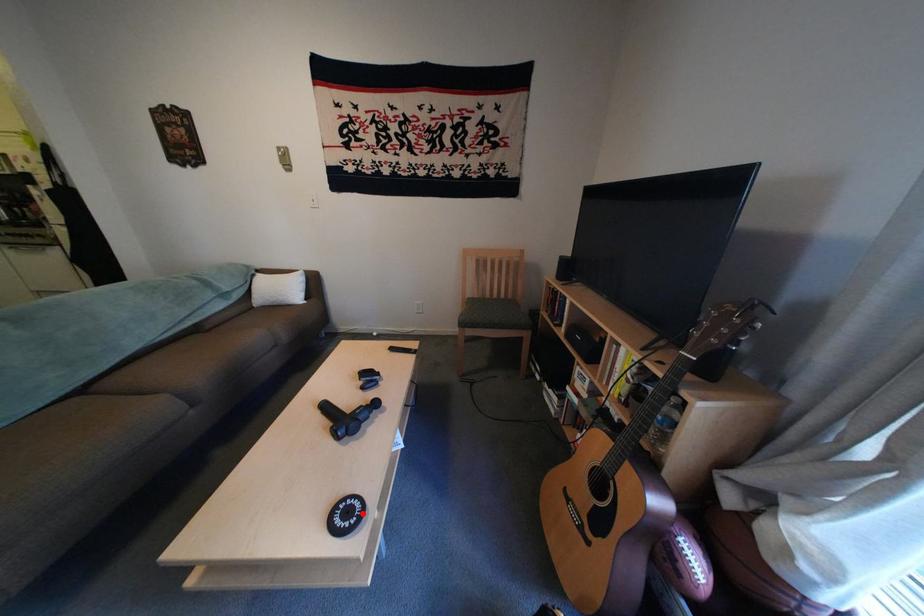
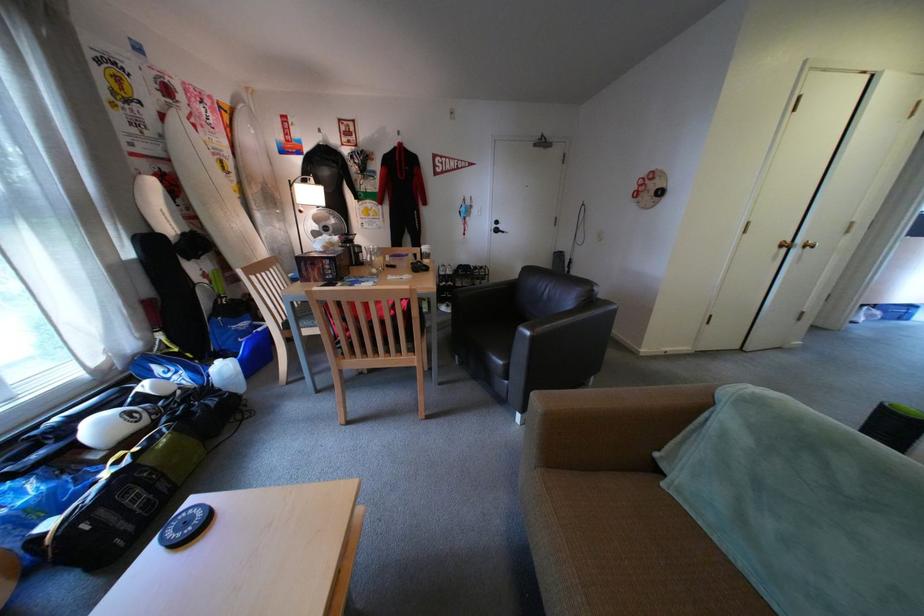
Question: I am providing you with two images of the same scene from different viewpoints. Image1 has a red point marked. In image2, the corresponding 3D location appears at what relative position? Reply with the corresponding letter.

Choices:
 (A) Closer
 (B) Farther

Answer: (B)